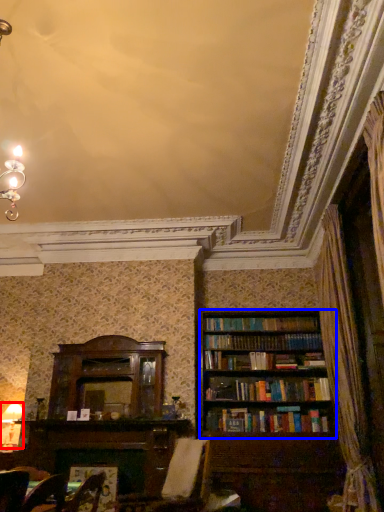
Question: Which object appears farthest to the camera in this image, lamp (highlighted by a red box) or bookcase (highlighted by a blue box)?

Choices:
 (A) lamp
 (B) bookcase

Answer: (A)